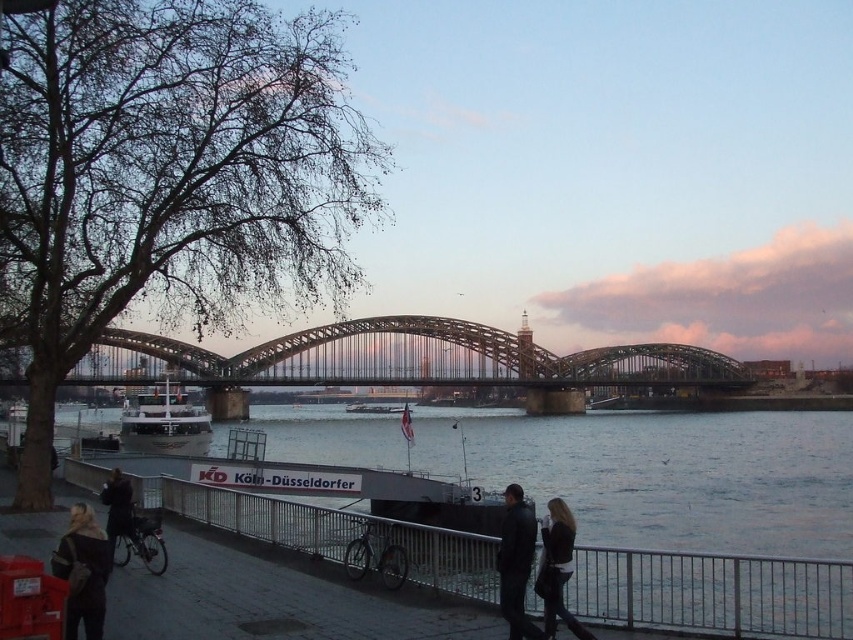
You are a photographer standing on the riverside walkway. You see the dark brown leather jacket at lower left and the white glossy boat at center. Which object is taller?

The dark brown leather jacket at lower left is taller than the white glossy boat at center.

You are a photographer standing on the riverside walkway. You want to take a photo of the shiny silver boat at center without the brown fur coat at lower left blocking the view. Where should you move to achieve this?

The brown fur coat at lower left is in front of the shiny silver boat at center. To avoid the fur coat blocking the view of the boat, you should move to a position where the boat is no longer behind the coat. This could involve moving to the right side of the walkway or further away from the coat so that the boat becomes visible without obstruction.